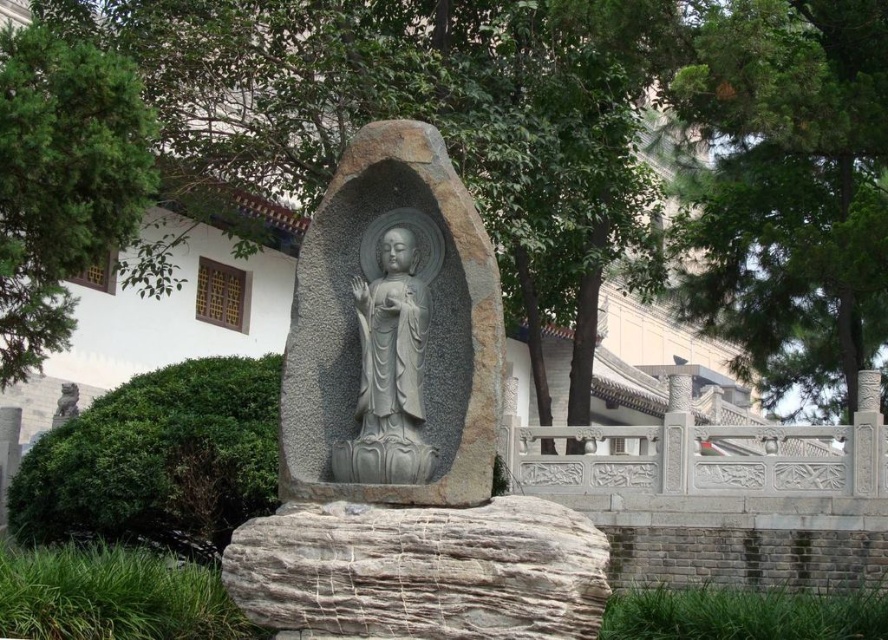
You are planning to install a small garden path between the green leafy tree at center and the green leafy tree at upper right. What is the minimum length the path should be to connect them?

The minimum length the path should be to connect the green leafy tree at center and the green leafy tree at upper right is 7.74 meters, as they are 7.74 meters apart.

You are standing in front of the Buddha statue and notice two green leafy trees in the scene. Which tree, the green leafy tree at center or the green leafy tree at upper left, is positioned higher relative to the Buddha statue?

The green leafy tree at center is located above the green leafy tree at upper left, so it is positioned higher relative to the Buddha statue.

You are standing in front of the white stone statue at center and want to take a photo of it. To avoid including the green leafy tree at upper left in your photo, which direction should you move?

Move to the right side of the white stone statue at center because the green leafy tree at upper left is located to the left of it.